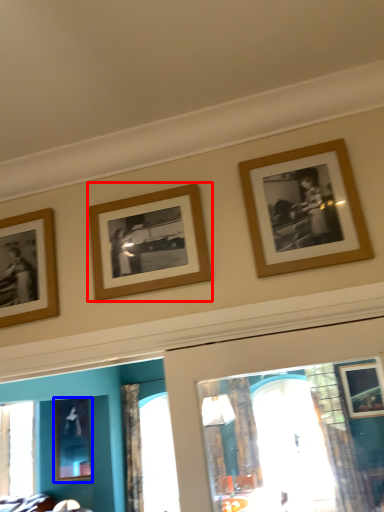
Question: Which object is closer to the camera taking this photo, picture frame (highlighted by a red box) or picture frame (highlighted by a blue box)?

Choices:
 (A) picture frame
 (B) picture frame

Answer: (A)